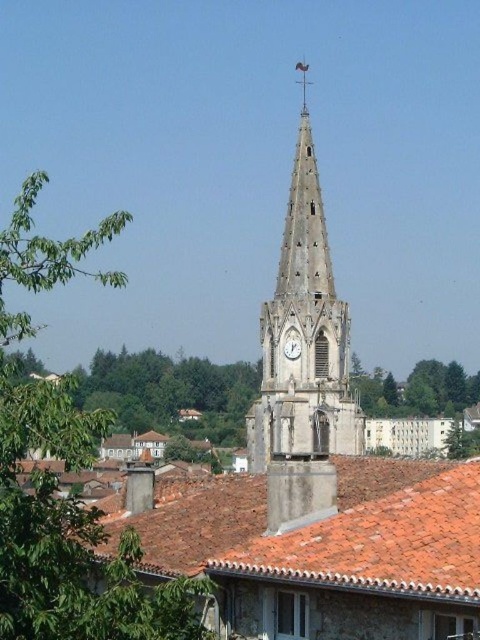
In the scene shown: You are an architect designing a new town layout. You need to ensure that the red clay tiles at center and the green leafy tree at center are visible from the main square. Given their sizes, which object might require strategic placement to ensure visibility?

The red clay tiles at center has a smaller size compared to green leafy tree at center, so the red clay tiles at center might require strategic placement to ensure visibility due to its smaller size.

You are standing in the town square looking towards the church steeple. You notice both the red clay tiles at center and the white stone clock at center. Which object appears closer to you in the scene?

The red clay tiles at center appear closer because they are positioned in front of the white stone clock at center.

You are a painter standing in front of the town scene. You want to paint the green leafy tree at center first. Which direction should you look to find the red clay tiles at center?

The red clay tiles at center is positioned on the left side of green leafy tree at center, so you should look to the left to find the red clay tiles at center.